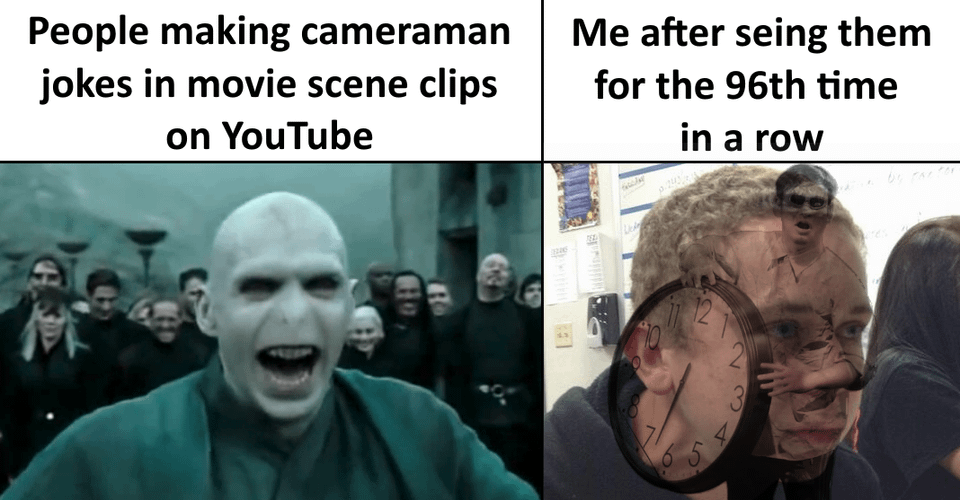
At what (x,y) coordinates should I click in order to perform the action: click on wall. Please return your answer as a coordinate pair (x, y). Image resolution: width=960 pixels, height=500 pixels. Looking at the image, I should click on (518, 253), (416, 246), (585, 337).